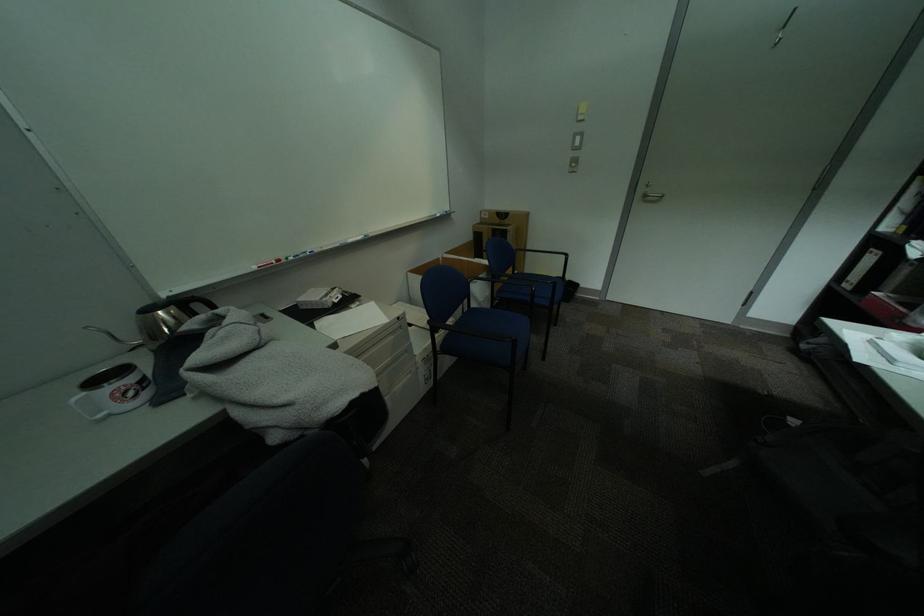
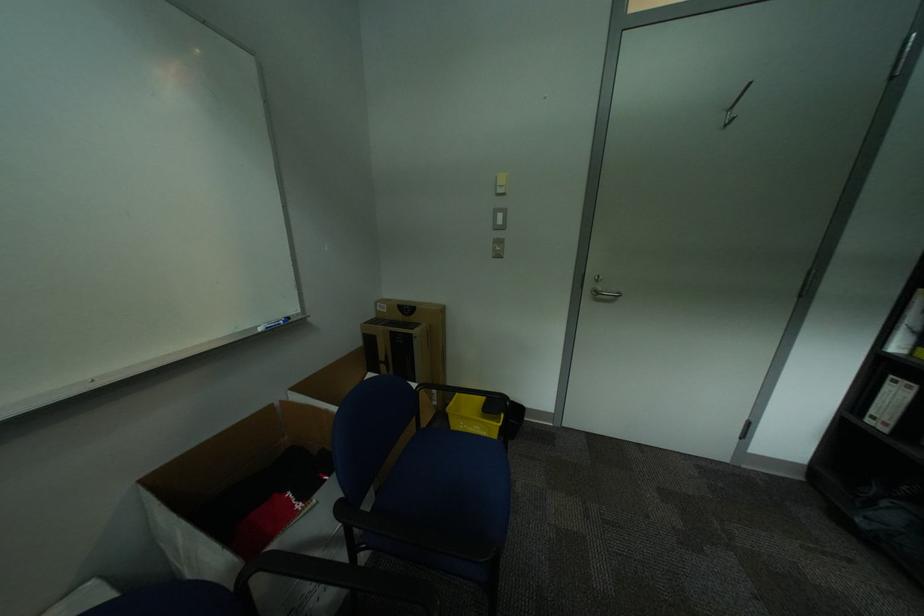
Question: I am providing you with two images of the same scene from different viewpoints. Please identify which objects are invisible in image2.

Choices:
 (A) blue whiteboard marker
 (B) yellow plastic bin
 (C) blue chair sitting surface
 (D) none of these

Answer: (D)